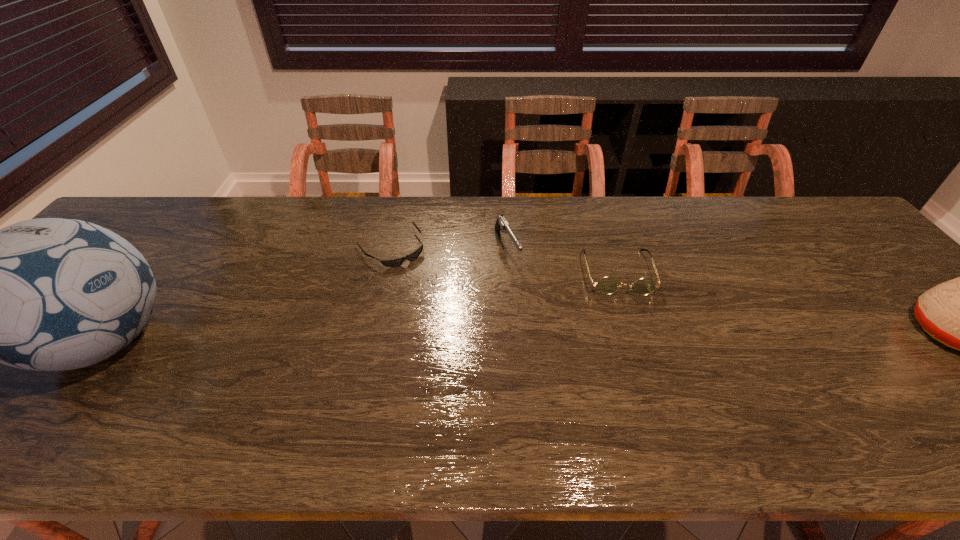
In the image, there is a desktop. Identify the location of vacant space at the far left corner. (121, 226).

Identify the location of free space between the spectacles and the third object from left to right. (563, 259).

The width and height of the screenshot is (960, 540). I want to click on free space between the second shortest object and the second object from left to right, so click(504, 259).

Locate an element on the screen. Image resolution: width=960 pixels, height=540 pixels. free spot between the third tallest object and the shortest object is located at coordinates (449, 247).

This screenshot has height=540, width=960. Identify the location of empty space between the second object from right to left and the shortest object. (504, 259).

The image size is (960, 540). In order to click on the fourth closest object relative to the leftmost object in this screenshot , I will do `click(959, 313)`.

Identify which object is located as the third nearest to the second object from right to left. Please provide its 2D coordinates. Your answer should be formatted as a tuple, i.e. [(x, y)], where the tuple contains the x and y coordinates of a point satisfying the conditions above.

[(959, 313)]